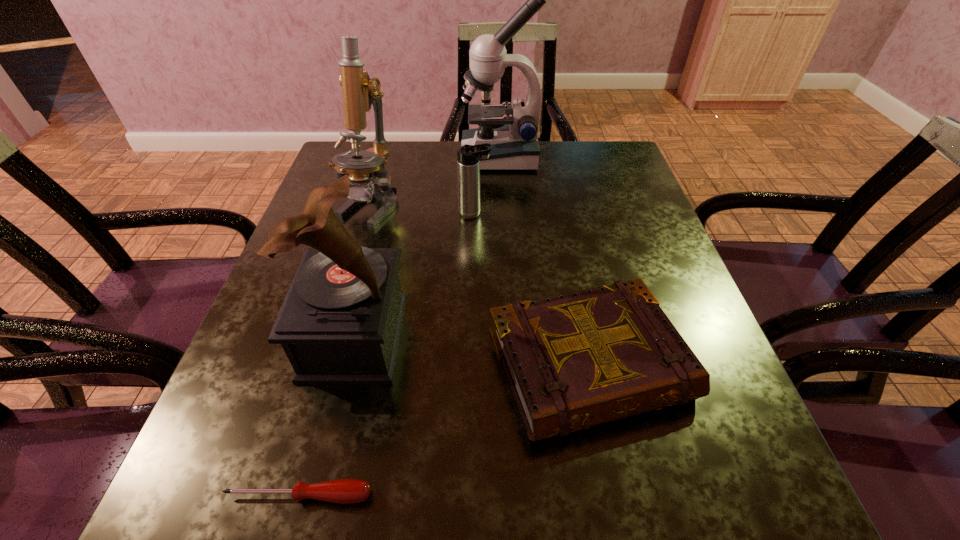
The image size is (960, 540). In order to click on free location that satisfies the following two spatial constraints: 1. on the handle side of the hardback book; 2. on the right side of the thermos bottle in this screenshot , I will do `click(473, 366)`.

This screenshot has width=960, height=540. I want to click on vacant space that satisfies the following two spatial constraints: 1. at the horn opening of the phonograph_record; 2. on the right side of the fifth tallest object, so click(348, 366).

Where is `vacant point that satisfies the following two spatial constraints: 1. at the horn opening of the hardback book; 2. on the left side of the phonograph_record`? This screenshot has width=960, height=540. vacant point that satisfies the following two spatial constraints: 1. at the horn opening of the hardback book; 2. on the left side of the phonograph_record is located at coordinates (348, 366).

I want to click on vacant point that satisfies the following two spatial constraints: 1. on the handle side of the third shortest object; 2. on the back side of the hardback book, so click(473, 366).

Image resolution: width=960 pixels, height=540 pixels. I want to click on free location that satisfies the following two spatial constraints: 1. at the eyepiece of the second shortest object; 2. on the right side of the farthest object, so click(x=513, y=366).